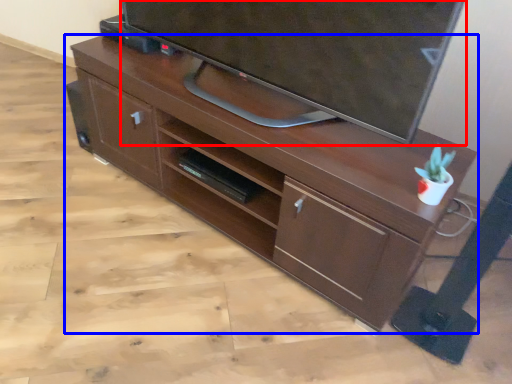
Question: Which object is further to the camera taking this photo, television (highlighted by a red box) or desk (highlighted by a blue box)?

Choices:
 (A) television
 (B) desk

Answer: (B)